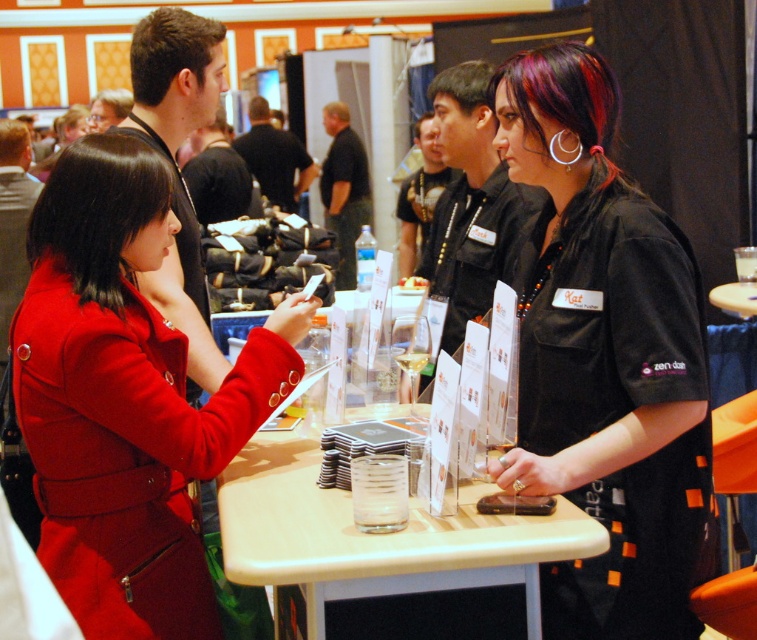
Question: Does black matte shirt at center appear over translucent plastic table at center?

Choices:
 (A) yes
 (B) no

Answer: (A)

Question: Which point appears farthest from the camera in this image?

Choices:
 (A) (298, 333)
 (B) (164, 77)
 (C) (441, 83)
 (D) (0, 150)

Answer: (D)

Question: Which object is farther from the camera taking this photo?

Choices:
 (A) black matte shirt at center
 (B) black silky hair at left
 (C) brown matte hair at upper left
 (D) blonde hair at upper left

Answer: (D)

Question: Which of the following is the farthest from the observer?

Choices:
 (A) (13, 134)
 (B) (195, 65)

Answer: (A)

Question: Is matte red coat at left thinner than black silky hair at left?

Choices:
 (A) no
 (B) yes

Answer: (A)

Question: Can you confirm if matte red coat at left is positioned to the left of dark brown hair at center?

Choices:
 (A) yes
 (B) no

Answer: (A)